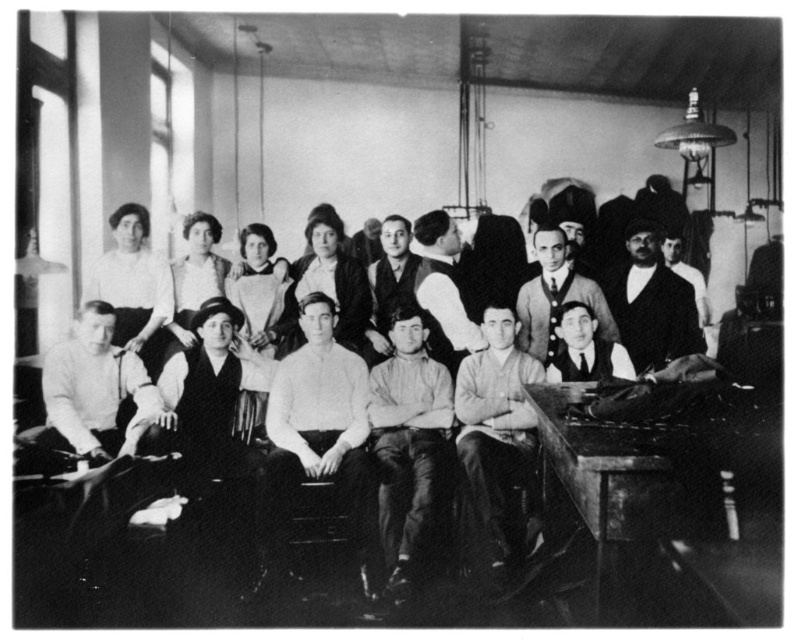
Question: Can you confirm if matte black dress at center is smaller than smooth white shirt at center?

Choices:
 (A) no
 (B) yes

Answer: (A)

Question: Considering the real-world distances, which object is closest to the smooth white blouse at upper left?

Choices:
 (A) white knit sweater at center
 (B) smooth brown shirt at center

Answer: (A)

Question: Which object is positioned closest to the smooth dark fabric jacket at right?

Choices:
 (A) smooth black dress at center
 (B) smooth white blouse at center

Answer: (B)

Question: Based on their relative distances, which object is nearer to the smooth white blouse at upper left?

Choices:
 (A) smooth dark fabric jacket at right
 (B) smooth black dress at center
 (C) smooth gray sweater at center

Answer: (B)

Question: Does wooden table at lower right have a larger size compared to smooth black dress at center?

Choices:
 (A) yes
 (B) no

Answer: (A)

Question: Observing the image, what is the correct spatial positioning of smooth white blouse at center in reference to smooth gray sweater at center?

Choices:
 (A) right
 (B) left

Answer: (B)